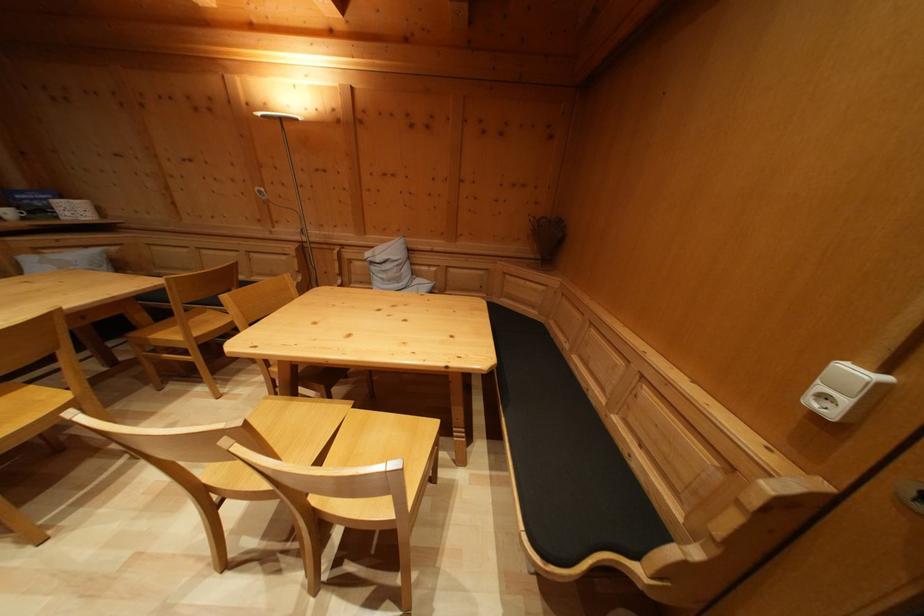
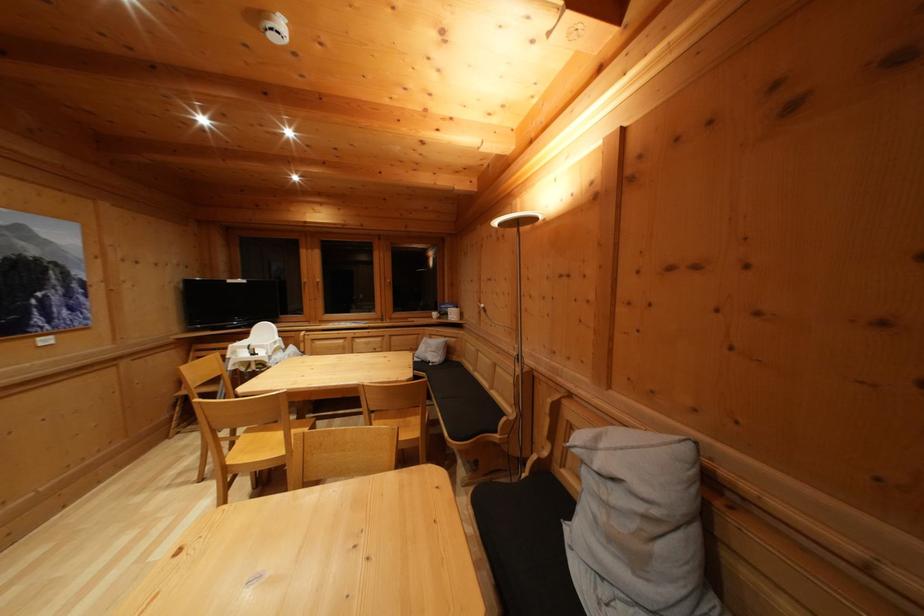
In the second image, find the point that corresponds to the point at 404,286 in the first image.

(640, 565)